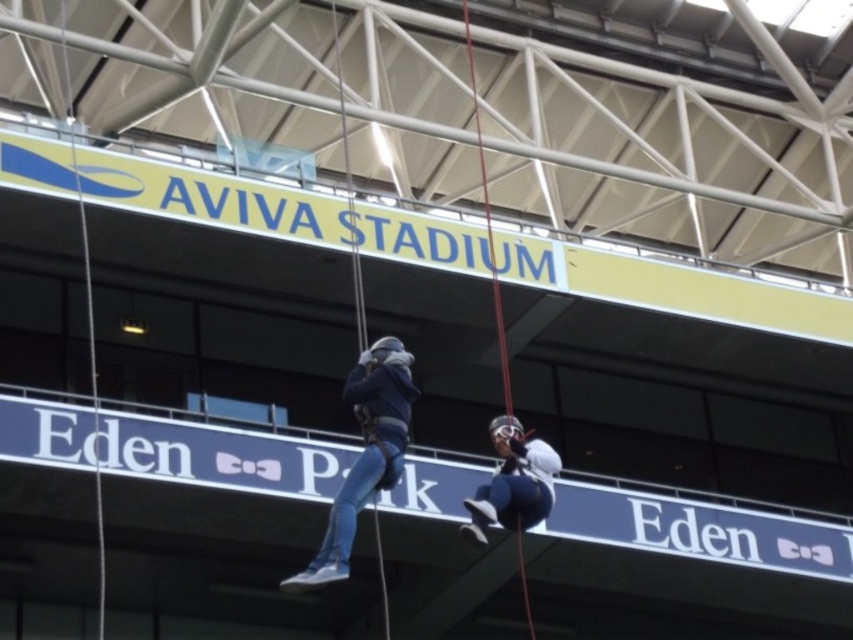
Does point (398, 385) come farther from viewer compared to point (486, 506)?

Yes.

Does point (369, 460) come closer to viewer compared to point (505, 492)?

Yes.

Identify the location of blue denim jeans at center. Image resolution: width=853 pixels, height=640 pixels. (364, 452).